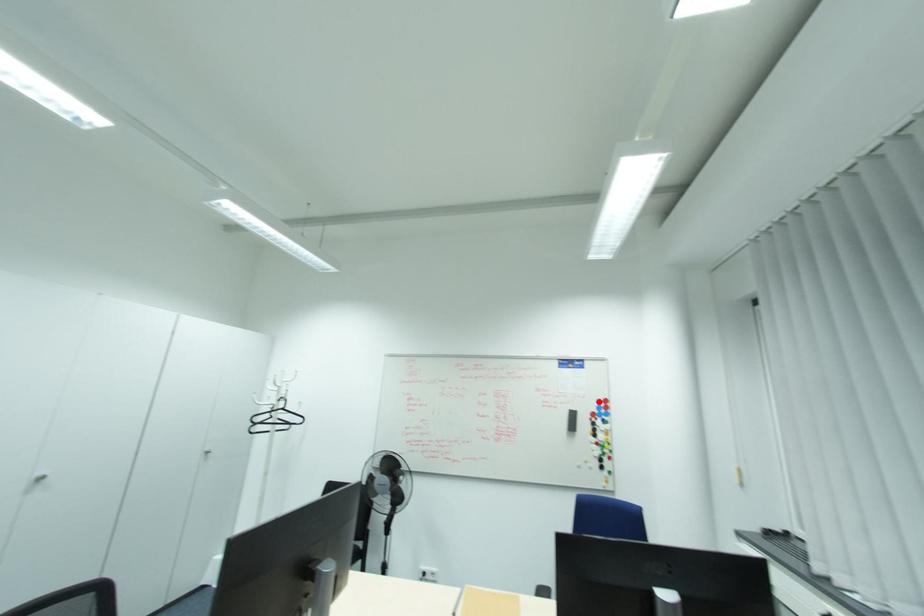
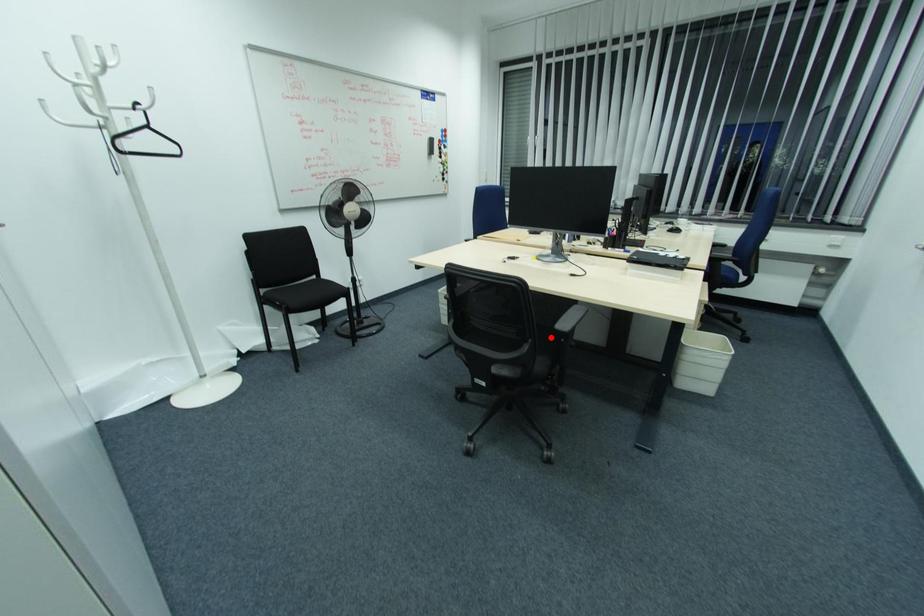
I am providing you with two images of the same scene from different viewpoints. A red point is marked on the first image and another point is marked on the second image. Is the marked point in image1 the same physical position as the marked point in image2?

No